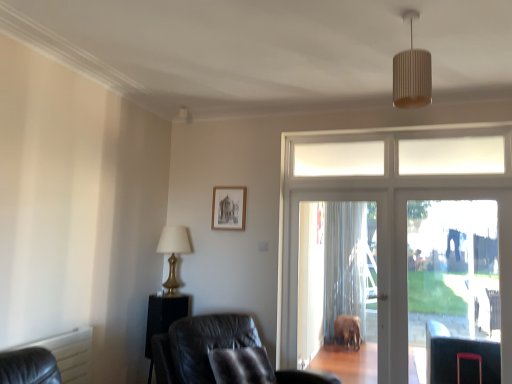
Question: From their relative heights in the image, would you say white ribbed shade at upper center is taller or shorter than black leather side table at lower left?

Choices:
 (A) tall
 (B) short

Answer: (B)

Question: From the image's perspective, is white ribbed shade at upper center positioned above or below black leather side table at lower left?

Choices:
 (A) below
 (B) above

Answer: (B)

Question: Which object is positioned closest to the transparent glass screen door at right, the 1th screen door from the right?

Choices:
 (A) translucent plastic screen door at center, acting as the first screen door starting from the left
 (B) white ribbed shade at upper center
 (C) white glass door at center
 (D) wooden picture frame at center
 (E) leather chair at lower center

Answer: (C)

Question: Estimate the real-world distances between objects in this image. Which object is farther from the white ribbed shade at upper center?

Choices:
 (A) translucent plastic screen door at center, acting as the 2th screen door starting from the right
 (B) wooden picture frame at center
 (C) white glass door at center
 (D) transparent glass screen door at right, which is the second screen door in left-to-right order
 (E) black leather side table at lower left

Answer: (D)